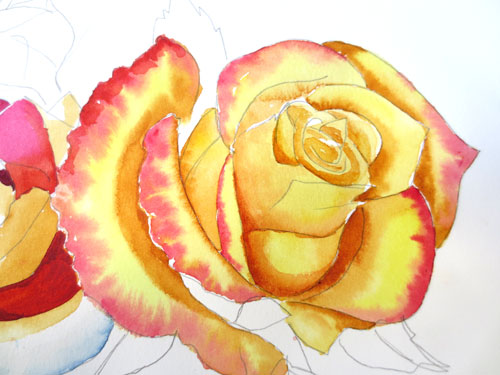
Identify the location of artwork. The image size is (500, 375). pyautogui.click(x=283, y=186).